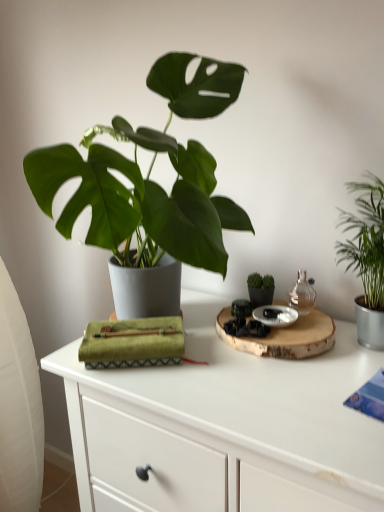
In order to click on vacant area on top of white matte table at center (from a real-world perspective) in this screenshot , I will do `click(239, 365)`.